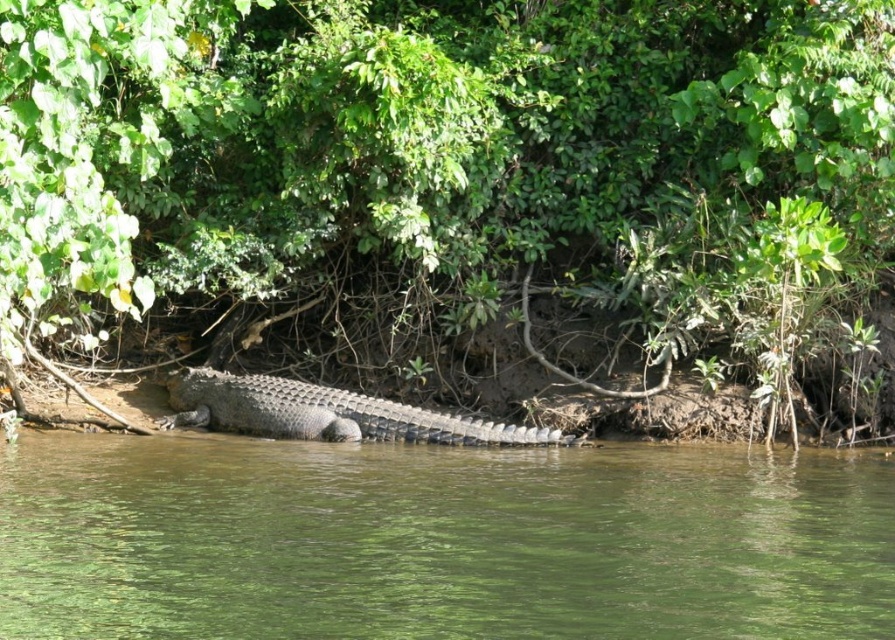
You are a hiker trying to cross the river using the shoreline where the crocodile is resting. The green leafy tree at center is your landmark. Based on its position, which direction should you head relative to the tree to avoid the crocodile?

The green leafy tree at center is located at point (449, 180). Since the crocodile is on the shoreline edge, you should head in the opposite direction away from the shoreline towards the tree to avoid the crocodile.